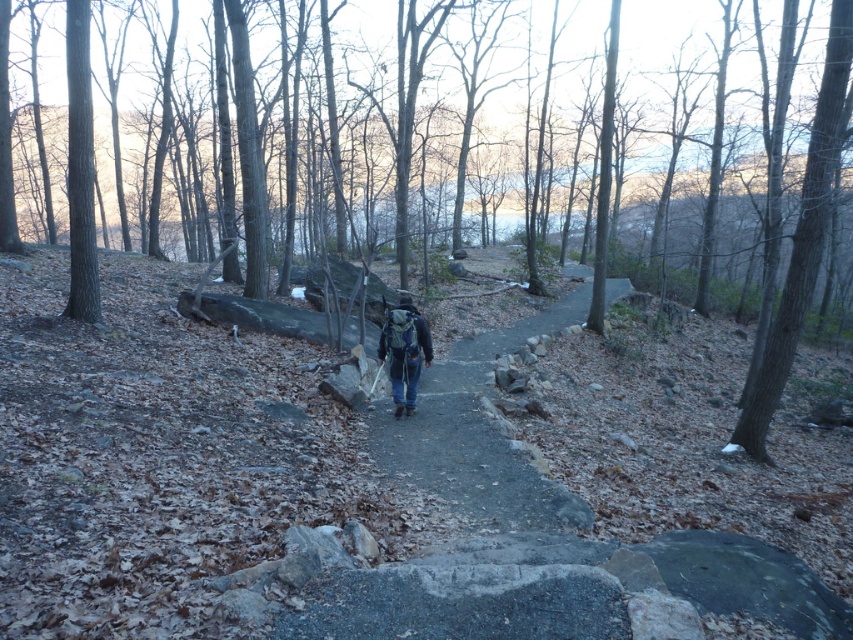
Question: Is smooth gray stone path at center bigger than dark blue jeans at center?

Choices:
 (A) no
 (B) yes

Answer: (B)

Question: Which point appears closest to the camera in this image?

Choices:
 (A) (550, 518)
 (B) (399, 365)

Answer: (A)

Question: Is smooth gray stone path at center smaller than dark blue jeans at center?

Choices:
 (A) yes
 (B) no

Answer: (B)

Question: Is smooth gray stone path at center to the right of dark blue jeans at center from the viewer's perspective?

Choices:
 (A) yes
 (B) no

Answer: (A)

Question: Among these points, which one is farthest from the camera?

Choices:
 (A) (403, 369)
 (B) (469, 413)

Answer: (B)